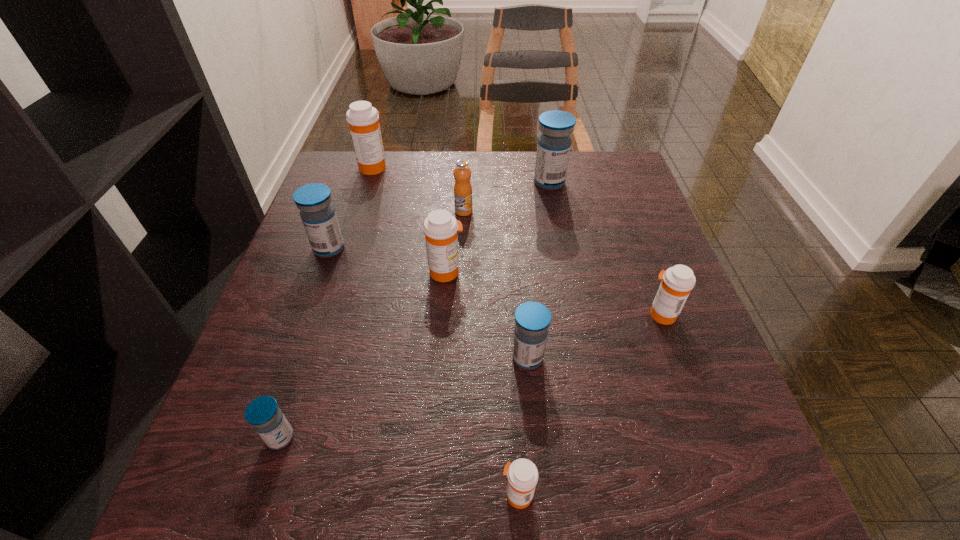
Identify which orange medicine is located as the second nearest to the leftmost orange medicine. Please provide its 2D coordinates. Your answer should be formatted as a tuple, i.e. [(x, y)], where the tuple contains the x and y coordinates of a point satisfying the conditions above.

[(677, 282)]

What are the coordinates of `vacant space that satisfies the following two spatial constraints: 1. on the front side of the seventh farthest object; 2. on the left side of the leftmost orange medicine` in the screenshot? It's located at (314, 357).

In order to click on free point that satisfies the following two spatial constraints: 1. on the front label of the orange juice; 2. on the right side of the fifth farthest medicine in this screenshot , I will do click(460, 314).

This screenshot has height=540, width=960. What are the coordinates of `free space that satisfies the following two spatial constraints: 1. on the front side of the biggest orange medicine; 2. on the left side of the fourth farthest medicine` in the screenshot? It's located at (340, 272).

Locate an element on the screen. The image size is (960, 540). free location that satisfies the following two spatial constraints: 1. on the back side of the third farthest blue medicine; 2. on the right side of the rightmost object is located at coordinates (524, 314).